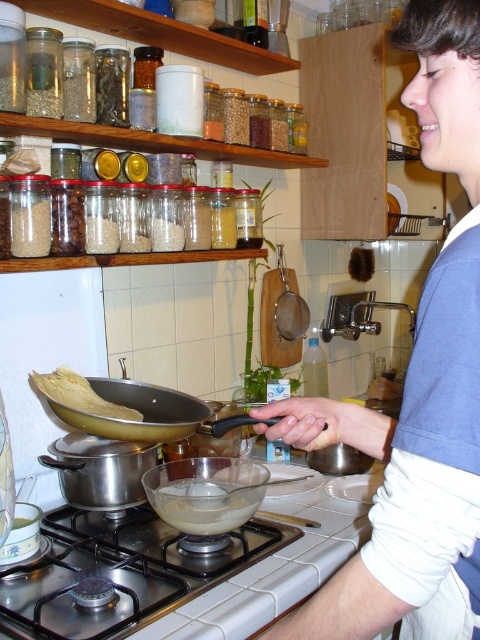
Does blue cotton shirt at upper right have a greater height compared to gold matte wok at center?

Yes.

Does blue cotton shirt at upper right appear over gold matte wok at center?

Yes, blue cotton shirt at upper right is above gold matte wok at center.

Does point (371, 630) come behind point (182, 429)?

No.

The width and height of the screenshot is (480, 640). Find the location of `blue cotton shirt at upper right`. blue cotton shirt at upper right is located at coordinates (418, 390).

Is blue cotton shirt at upper right smaller than stainless steel gas stove at lower center?

Incorrect, blue cotton shirt at upper right is not smaller in size than stainless steel gas stove at lower center.

The width and height of the screenshot is (480, 640). What do you see at coordinates (418, 390) in the screenshot?
I see `blue cotton shirt at upper right` at bounding box center [418, 390].

The width and height of the screenshot is (480, 640). What do you see at coordinates (418, 390) in the screenshot? I see `blue cotton shirt at upper right` at bounding box center [418, 390].

This screenshot has width=480, height=640. I want to click on blue cotton shirt at upper right, so click(418, 390).

Based on the photo, between gold matte wok at center and translucent glass bowl at center, which one has more height?

Standing taller between the two is gold matte wok at center.

Who is more distant from viewer, (93, 380) or (210, 483)?

The point (93, 380) is more distant.

This screenshot has width=480, height=640. What are the coordinates of `gold matte wok at center` in the screenshot? It's located at (130, 410).